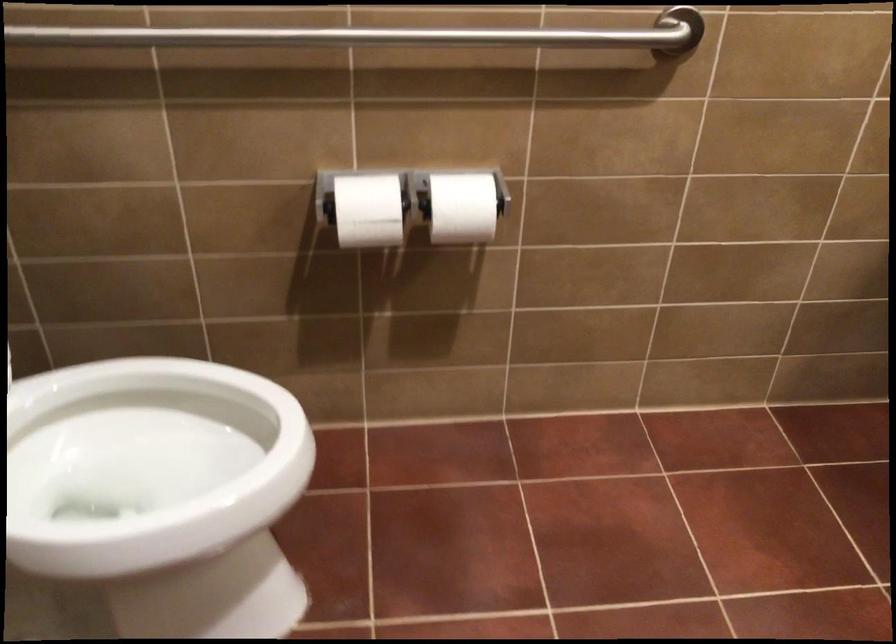
Find the location of a particular element. This screenshot has height=644, width=896. metal grab bar is located at coordinates (378, 35).